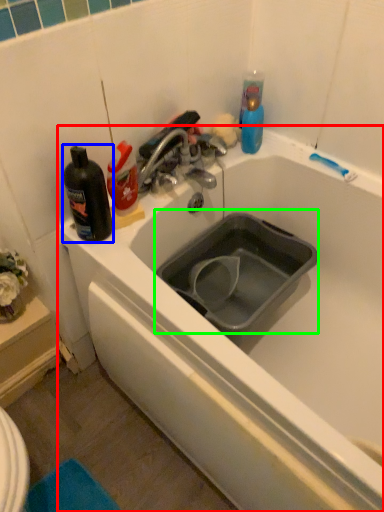
Question: Based on their relative distances, which object is nearer to bathtub (highlighted by a red box)? Choose from bottle (highlighted by a blue box) and sink (highlighted by a green box).

Choices:
 (A) bottle
 (B) sink

Answer: (B)